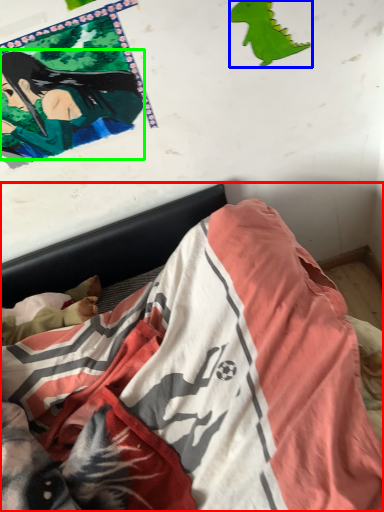
Question: Based on their relative distances, which object is nearer to bed (highlighted by a red box)? Choose from print (highlighted by a blue box) and person (highlighted by a green box).

Choices:
 (A) print
 (B) person

Answer: (B)